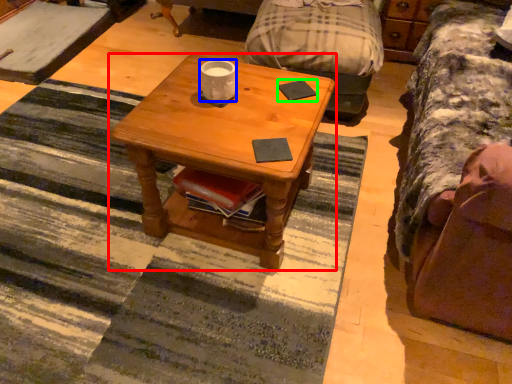
Question: Estimate the real-world distances between objects in this image. Which object is closer to coffee table (highlighted by a red box), coffee cup (highlighted by a blue box) or pad (highlighted by a green box)?

Choices:
 (A) coffee cup
 (B) pad

Answer: (A)